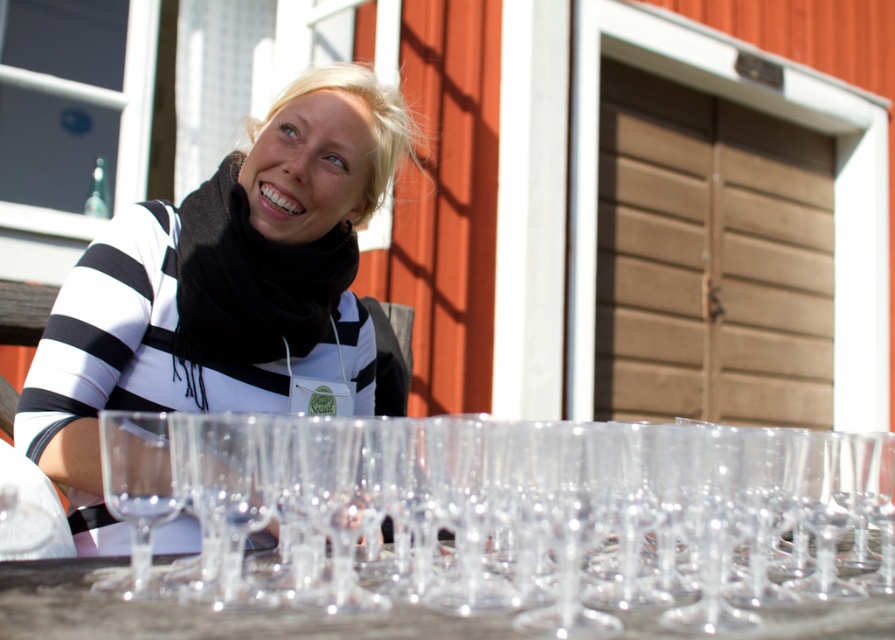
You are a server at a wine tasting event. You need to place a new wine glass exactly halfway between the two existing glasses located at point (303, 500). What are the coordinates of the midpoint?

The midpoint between the two points at (303, 500) would be calculated by averaging their coordinates. However, since both points are the same, the midpoint is also at (303, 500). Therefore, place the new wine glass at coordinates (303, 500).

You are a bartender at a party and need to choose between the transparent glass wine glass at center and the transparent glassware at lower center for serving a tall cocktail. Based on their sizes, which one would be more suitable?

The transparent glass wine glass at center is much taller than the transparent glassware at lower center, so it would be more suitable for serving a tall cocktail.